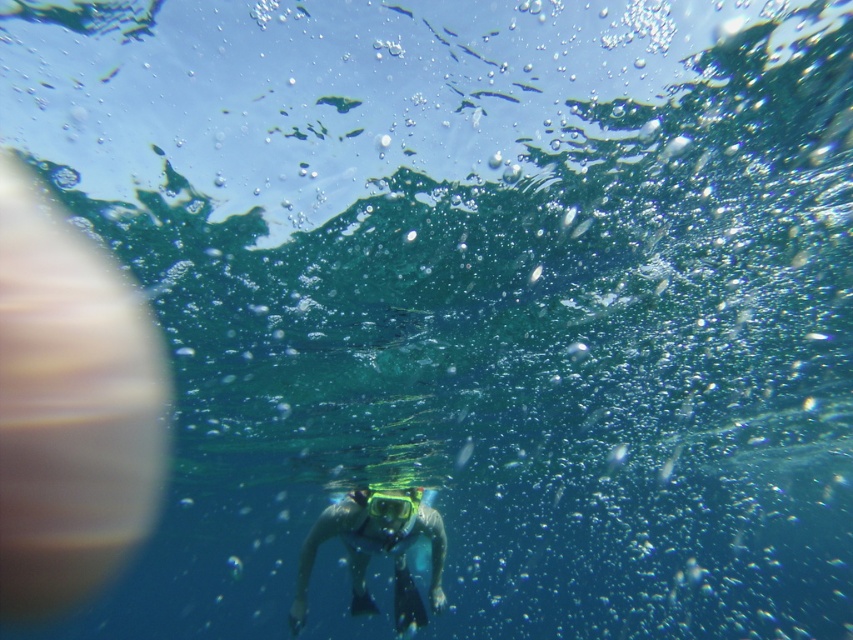
Question: Is blue matte snorkeling gear at center below clear plastic goggles at center?

Choices:
 (A) no
 (B) yes

Answer: (B)

Question: Which point is closer to the camera?

Choices:
 (A) (306, 580)
 (B) (376, 513)

Answer: (B)

Question: Does blue matte snorkeling gear at center have a lesser width compared to clear plastic goggles at center?

Choices:
 (A) yes
 (B) no

Answer: (B)

Question: Considering the relative positions of blue matte snorkeling gear at center and clear plastic goggles at center in the image provided, where is blue matte snorkeling gear at center located with respect to clear plastic goggles at center?

Choices:
 (A) left
 (B) right

Answer: (A)